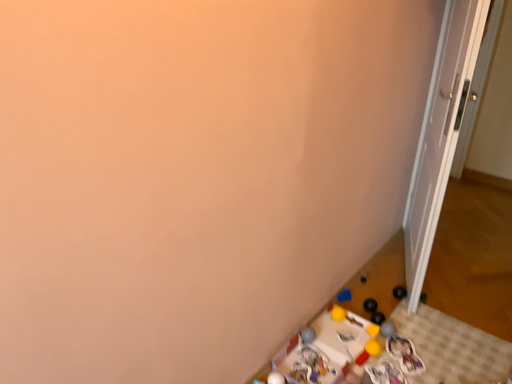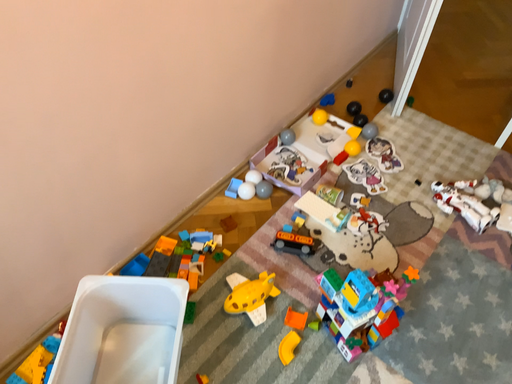
Question: Which way did the camera rotate in the video?

Choices:
 (A) rotated upward
 (B) rotated downward

Answer: (B)